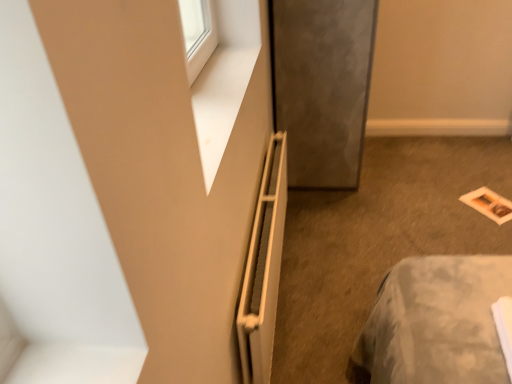
Question: Choose the correct answer: Is white matte radiator at center inside matte paper magazine at lower right or outside it?

Choices:
 (A) outside
 (B) inside

Answer: (A)

Question: In the image, is white matte radiator at center positioned in front of or behind matte paper magazine at lower right?

Choices:
 (A) front
 (B) behind

Answer: (A)

Question: Considering the real-world distances, which object is closest to the matte gray screen door at center?

Choices:
 (A) matte paper magazine at lower right
 (B) white matte radiator at center

Answer: (B)

Question: Estimate the real-world distances between objects in this image. Which object is farther from the white matte radiator at center?

Choices:
 (A) matte gray screen door at center
 (B) matte paper magazine at lower right

Answer: (B)